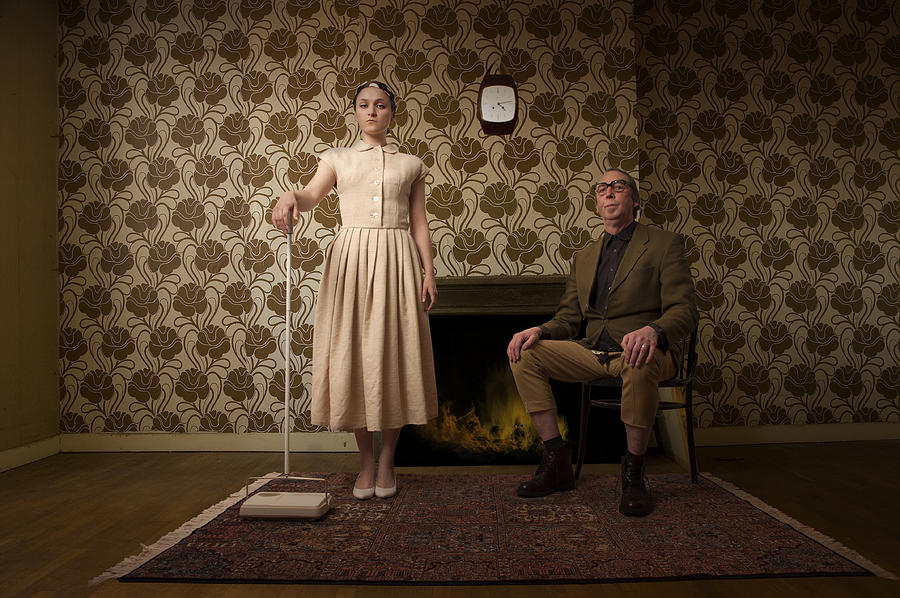
The height and width of the screenshot is (598, 900). I want to click on dark beige wall, so click(32, 197).